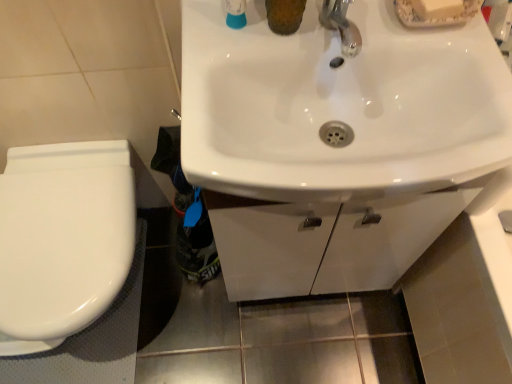
Find the location of a particular element. Image resolution: width=512 pixels, height=384 pixels. free spot above white glossy toilet at left (from a real-world perspective) is located at coordinates (57, 234).